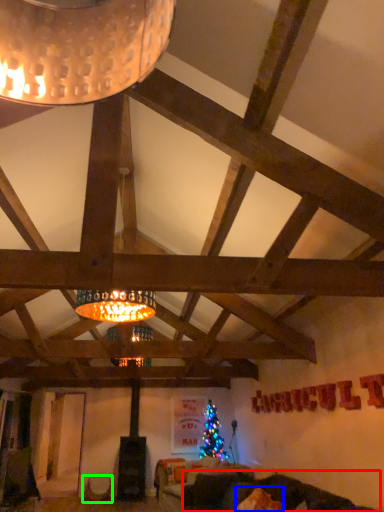
Question: Which object is the closest to the couch (highlighted by a red box)? Choose among these: pillow (highlighted by a blue box) or furniture (highlighted by a green box).

Choices:
 (A) pillow
 (B) furniture

Answer: (A)